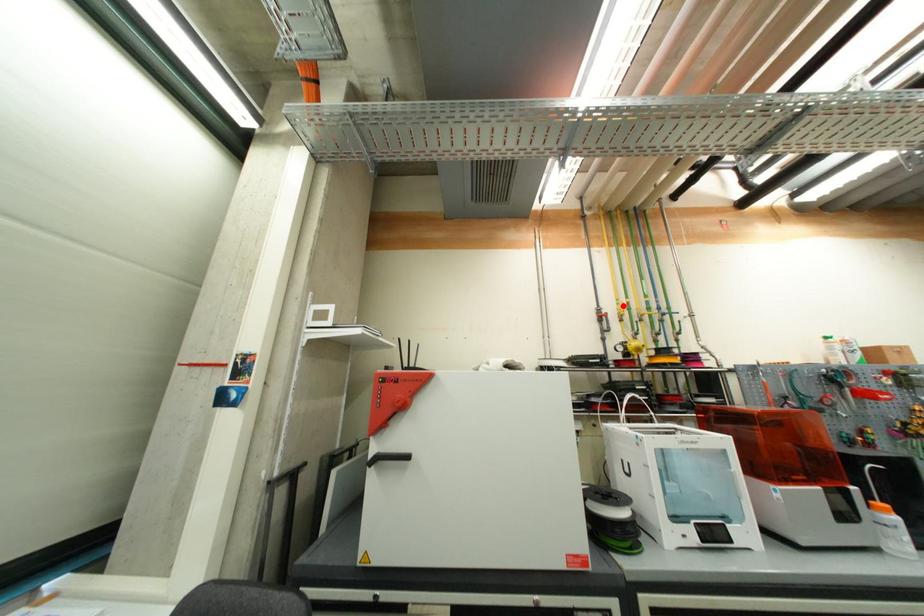
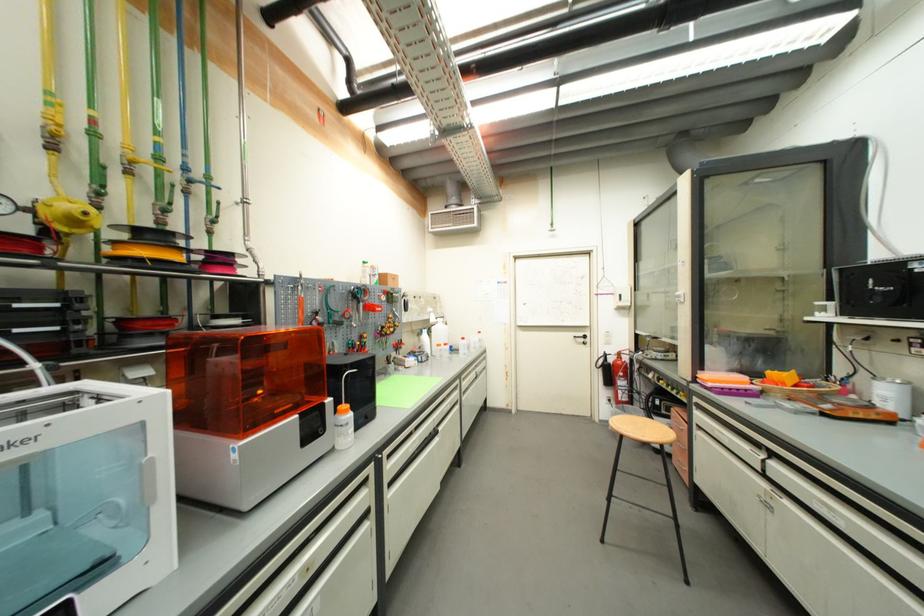
Locate, in the second image, the point that corresponds to the highlighted location in the first image.

(55, 106)